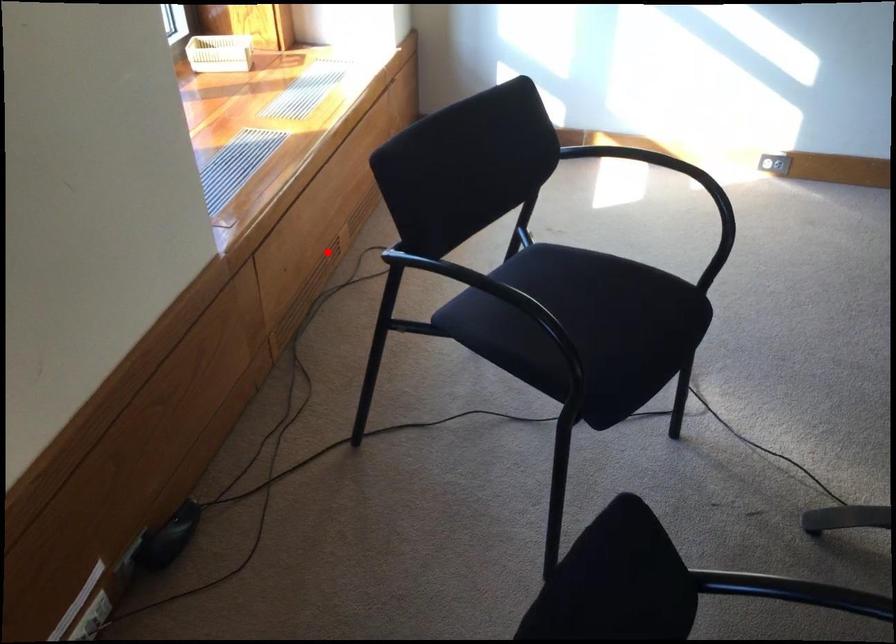
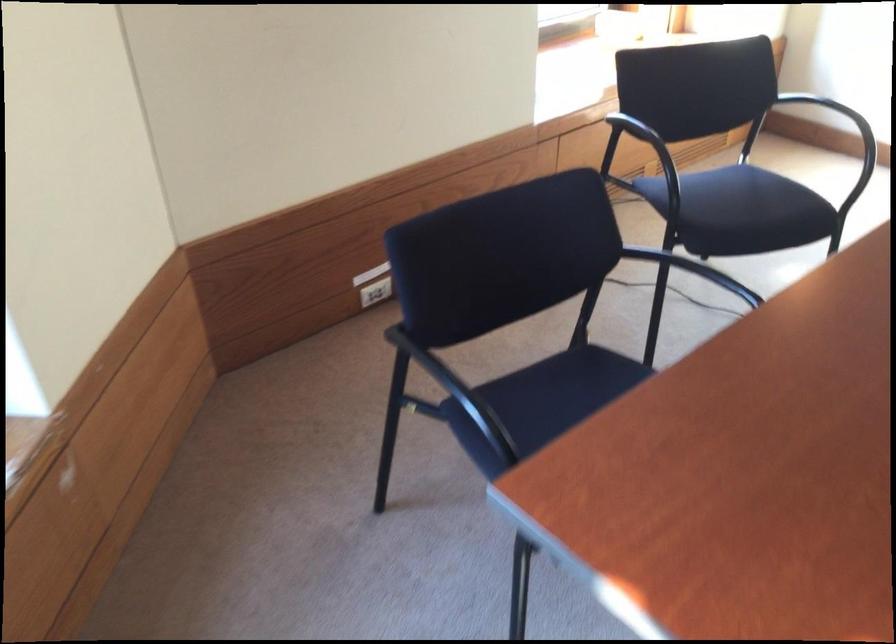
Locate, in the second image, the point that corresponds to the highlighted location in the first image.

(642, 158)